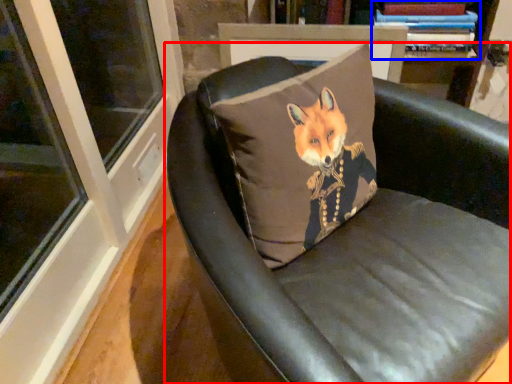
Question: Among these objects, which one is nearest to the camera, chair (highlighted by a red box) or book (highlighted by a blue box)?

Choices:
 (A) chair
 (B) book

Answer: (A)